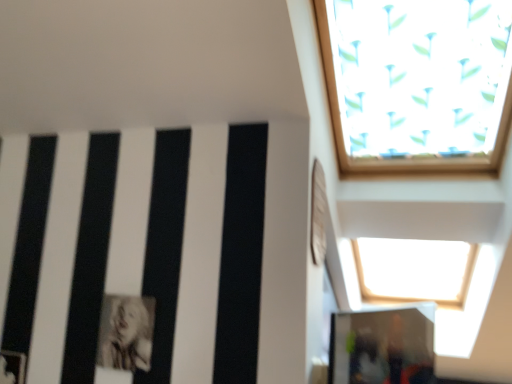
The height and width of the screenshot is (384, 512). Find the location of `transparent glass door at lower right`. transparent glass door at lower right is located at coordinates [x=381, y=347].

Image resolution: width=512 pixels, height=384 pixels. What do you see at coordinates (381, 347) in the screenshot?
I see `transparent glass door at lower right` at bounding box center [381, 347].

The image size is (512, 384). What do you see at coordinates (126, 333) in the screenshot?
I see `black and white photograph of a person at lower left` at bounding box center [126, 333].

In order to face black and white photograph of a person at lower left, should I rotate leftwards or rightwards?

Turn left approximately 16.432 degrees to face it.

Image resolution: width=512 pixels, height=384 pixels. I want to click on black and white photograph of a person at lower left, so click(x=126, y=333).

Locate an element on the screen. transparent glass door at lower right is located at coordinates (381, 347).

Between transparent glass door at lower right and black and white photograph of a person at lower left, which one appears on the left side from the viewer's perspective?

From the viewer's perspective, black and white photograph of a person at lower left appears more on the left side.

Does transparent glass door at lower right lie in front of black and white photograph of a person at lower left?

Yes, it is in front of black and white photograph of a person at lower left.

Does point (358, 355) lie behind point (145, 323)?

Yes, it is behind point (145, 323).

From the image's perspective, is transparent glass door at lower right located above black and white photograph of a person at lower left?

No, from the image's perspective, transparent glass door at lower right is not over black and white photograph of a person at lower left.

From a real-world perspective, who is located lower, transparent glass door at lower right or black and white photograph of a person at lower left?

transparent glass door at lower right is physically lower.

Considering the sizes of objects transparent glass door at lower right and black and white photograph of a person at lower left in the image provided, who is wider, transparent glass door at lower right or black and white photograph of a person at lower left?

transparent glass door at lower right.

In terms of height, does transparent glass door at lower right look taller or shorter compared to black and white photograph of a person at lower left?

transparent glass door at lower right is taller than black and white photograph of a person at lower left.

Which of these two, transparent glass door at lower right or black and white photograph of a person at lower left, is bigger?

transparent glass door at lower right.

Is transparent glass door at lower right outside of black and white photograph of a person at lower left?

transparent glass door at lower right lies outside black and white photograph of a person at lower left's area.

Are transparent glass door at lower right and black and white photograph of a person at lower left beside each other?

No, transparent glass door at lower right is not making contact with black and white photograph of a person at lower left.

Is transparent glass door at lower right facing towards black and white photograph of a person at lower left?

No, transparent glass door at lower right is not aimed at black and white photograph of a person at lower left.

Where is `person behind the transparent glass door at lower right`? This screenshot has height=384, width=512. person behind the transparent glass door at lower right is located at coordinates (126, 333).

Considering the relative positions of black and white photograph of a person at lower left and transparent glass door at lower right in the image provided, is black and white photograph of a person at lower left to the left of transparent glass door at lower right from the viewer's perspective?

Yes, black and white photograph of a person at lower left is to the left of transparent glass door at lower right.

Relative to transparent glass door at lower right, is black and white photograph of a person at lower left in front or behind?

black and white photograph of a person at lower left is positioned farther from the viewer than transparent glass door at lower right.

Between point (136, 351) and point (370, 351), which one is positioned behind?

The point (370, 351) is farther from the camera.

From the image's perspective, is black and white photograph of a person at lower left above or below transparent glass door at lower right?

black and white photograph of a person at lower left is above transparent glass door at lower right.

From a real-world perspective, is black and white photograph of a person at lower left located higher than transparent glass door at lower right?

Correct, in the physical world, black and white photograph of a person at lower left is higher than transparent glass door at lower right.

Can you confirm if black and white photograph of a person at lower left is thinner than transparent glass door at lower right?

Yes.

Between black and white photograph of a person at lower left and transparent glass door at lower right, which one has less height?

black and white photograph of a person at lower left.

Is black and white photograph of a person at lower left smaller than transparent glass door at lower right?

Correct, black and white photograph of a person at lower left occupies less space than transparent glass door at lower right.

Is black and white photograph of a person at lower left completely or partially outside of transparent glass door at lower right?

Yes, black and white photograph of a person at lower left is not within transparent glass door at lower right.

Are black and white photograph of a person at lower left and transparent glass door at lower right located far from each other?

They are positioned close to each other.

Could you tell me if black and white photograph of a person at lower left is turned towards transparent glass door at lower right?

No, black and white photograph of a person at lower left does not turn towards transparent glass door at lower right.

From the picture: Could you measure the distance between black and white photograph of a person at lower left and transparent glass door at lower right?

The distance of black and white photograph of a person at lower left from transparent glass door at lower right is 33.60 inches.

Where is `glass door that appears below the black and white photograph of a person at lower left (from a real-world perspective)`? The image size is (512, 384). glass door that appears below the black and white photograph of a person at lower left (from a real-world perspective) is located at coordinates (381, 347).

Find the location of `glass door in front of the black and white photograph of a person at lower left`. glass door in front of the black and white photograph of a person at lower left is located at coordinates (381, 347).

Image resolution: width=512 pixels, height=384 pixels. I want to click on person behind the transparent glass door at lower right, so click(x=126, y=333).